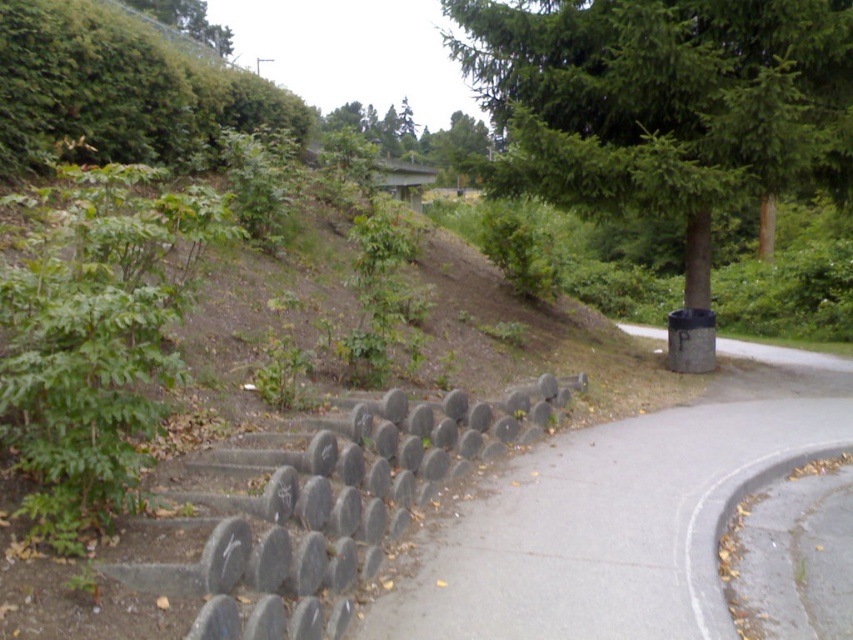
Question: Which point appears closest to the camera in this image?

Choices:
 (A) (322, 634)
 (B) (228, 36)
 (C) (801, 180)
 (D) (833, 428)

Answer: (A)

Question: Does gray concrete barrier at center come in front of green leafy tree at center?

Choices:
 (A) no
 (B) yes

Answer: (B)

Question: Is the position of gray concrete barrier at center more distant than that of green leafy tree at center?

Choices:
 (A) no
 (B) yes

Answer: (A)

Question: Does green textured tree at upper right appear over gray concrete barrier at center?

Choices:
 (A) no
 (B) yes

Answer: (B)

Question: Which object appears closest to the camera in this image?

Choices:
 (A) green leafy tree at center
 (B) green leafy tree at upper left
 (C) green textured tree at upper right

Answer: (C)

Question: Based on their relative distances, which object is farther from the green textured tree at upper right?

Choices:
 (A) green leafy tree at center
 (B) gray concrete barrier at center
 (C) gray concrete pavement at lower left

Answer: (A)